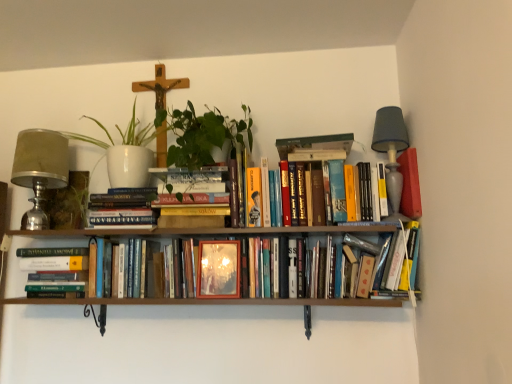
Question: Is matte wooden frame at center turned away from green matte vase at left?

Choices:
 (A) yes
 (B) no

Answer: (B)

Question: From a real-world perspective, is matte wooden frame at center located beneath green matte vase at left?

Choices:
 (A) yes
 (B) no

Answer: (A)

Question: Is matte wooden frame at center to the right of green matte vase at left from the viewer's perspective?

Choices:
 (A) no
 (B) yes

Answer: (B)

Question: Considering the relative sizes of matte wooden frame at center and green matte vase at left in the image provided, is matte wooden frame at center shorter than green matte vase at left?

Choices:
 (A) no
 (B) yes

Answer: (B)

Question: Considering the relative sizes of matte wooden frame at center and green matte vase at left in the image provided, is matte wooden frame at center bigger than green matte vase at left?

Choices:
 (A) yes
 (B) no

Answer: (B)

Question: Considering the positions of point (202, 296) and point (106, 150), is point (202, 296) closer or farther from the camera than point (106, 150)?

Choices:
 (A) closer
 (B) farther

Answer: (A)

Question: Would you say matte wooden frame at center is inside or outside white ceramic pot at upper left?

Choices:
 (A) inside
 (B) outside

Answer: (B)

Question: Is matte wooden frame at center in front of or behind white ceramic pot at upper left in the image?

Choices:
 (A) behind
 (B) front

Answer: (B)

Question: Based on their sizes in the image, would you say matte wooden frame at center is bigger or smaller than white ceramic pot at upper left?

Choices:
 (A) small
 (B) big

Answer: (A)

Question: Is white ceramic pot at upper left inside the boundaries of gray fabric lampshade at upper right, the first table lamp positioned from the right, or outside?

Choices:
 (A) outside
 (B) inside

Answer: (A)

Question: In terms of height, does white ceramic pot at upper left look taller or shorter compared to gray fabric lampshade at upper right, which ranks as the 2th table lamp in left-to-right order?

Choices:
 (A) short
 (B) tall

Answer: (A)

Question: Based on their positions, is white ceramic pot at upper left located to the left or right of gray fabric lampshade at upper right, which ranks as the 2th table lamp in left-to-right order?

Choices:
 (A) left
 (B) right

Answer: (A)

Question: Considering their positions, is white ceramic pot at upper left located in front of or behind gray fabric lampshade at upper right, the first table lamp positioned from the right?

Choices:
 (A) behind
 (B) front

Answer: (A)

Question: Considering the positions of point (240, 259) and point (47, 180), is point (240, 259) closer or farther from the camera than point (47, 180)?

Choices:
 (A) closer
 (B) farther

Answer: (A)

Question: Is matte wooden frame at center spatially inside matte silver table lamp at left, arranged as the 1th table lamp when viewed from the left, or outside of it?

Choices:
 (A) inside
 (B) outside

Answer: (B)